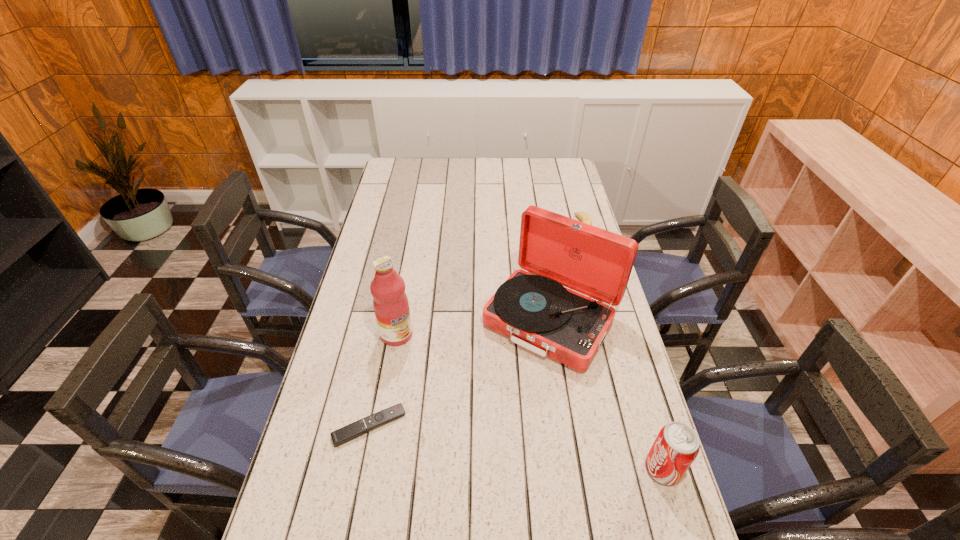
Where is `fruit juice located in the left edge section of the desktop`? fruit juice located in the left edge section of the desktop is located at coordinates (390, 302).

Locate an element on the screen. The width and height of the screenshot is (960, 540). soda can that is at the right edge is located at coordinates (677, 445).

The image size is (960, 540). What are the coordinates of `phonograph_record positioned at the right edge` in the screenshot? It's located at (532, 308).

This screenshot has width=960, height=540. In order to click on banana at the right edge in this screenshot , I will do `click(584, 217)`.

In the image, there is a desktop. Where is `vacant space at the far edge`? Image resolution: width=960 pixels, height=540 pixels. vacant space at the far edge is located at coordinates (453, 171).

The height and width of the screenshot is (540, 960). What are the coordinates of `free region at the near edge of the desktop` in the screenshot? It's located at (476, 508).

The height and width of the screenshot is (540, 960). In the image, there is a desktop. What are the coordinates of `vacant space at the left edge` in the screenshot? It's located at (400, 210).

This screenshot has width=960, height=540. I want to click on vacant space at the right edge of the desktop, so click(x=604, y=412).

You are a GUI agent. You are given a task and a screenshot of the screen. Output one action in this format:
    pyautogui.click(x=<x>, y=<y>)
    Task: Click on the vacant region at the far right corner of the desktop
    This screenshot has height=540, width=960.
    Given the screenshot: What is the action you would take?
    pyautogui.click(x=564, y=181)

The image size is (960, 540). I want to click on vacant area that lies between the fruit juice and the nearest object, so click(x=530, y=402).